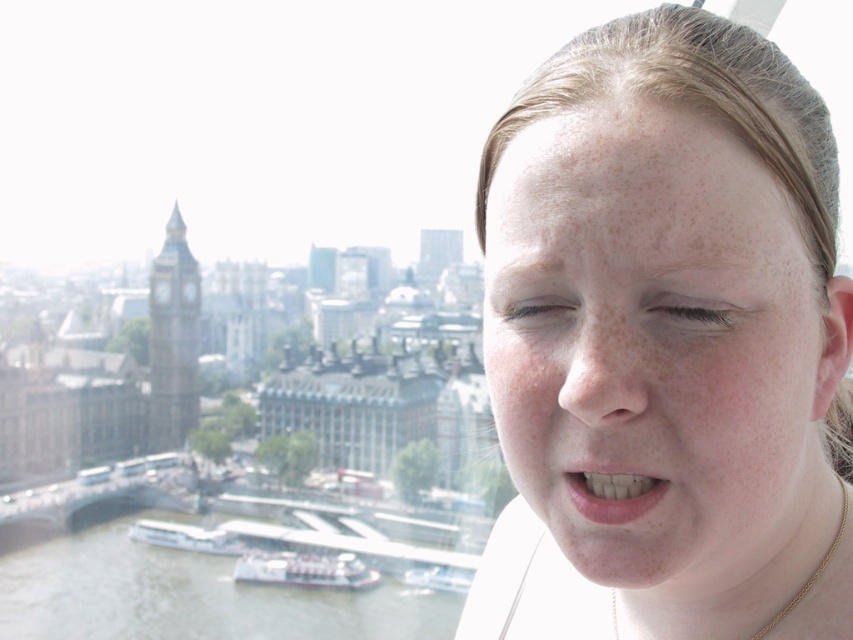
Does white plastic boat at lower left have a greater width compared to clear plastic boat at lower center?

Yes.

Looking at this image, which of these two, white plastic boat at lower left or clear plastic boat at lower center, stands taller?

clear plastic boat at lower center is taller.

Locate an element on the screen. white plastic boat at lower left is located at coordinates (186, 536).

Consider the image. Who is more forward, (x=601, y=547) or (x=190, y=531)?

Point (x=601, y=547) is in front.

The height and width of the screenshot is (640, 853). In order to click on smooth skin face at center in this screenshot , I will do `click(660, 348)`.

Is smooth skin face at center shorter than gold chain at lower right?

No, smooth skin face at center is not shorter than gold chain at lower right.

Where is `smooth skin face at center`? This screenshot has height=640, width=853. smooth skin face at center is located at coordinates (660, 348).

This screenshot has width=853, height=640. What do you see at coordinates (660, 348) in the screenshot?
I see `smooth skin face at center` at bounding box center [660, 348].

You are a GUI agent. You are given a task and a screenshot of the screen. Output one action in this format:
    pyautogui.click(x=<x>, y=<y>)
    Task: Click on the smooth skin face at center
    
    Given the screenshot: What is the action you would take?
    pos(660,348)